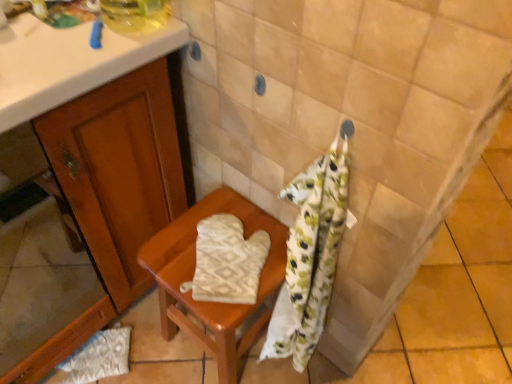
Identify the location of blank space situated above beige textured oven mitt at center (from a real-world perspective). (227, 259).